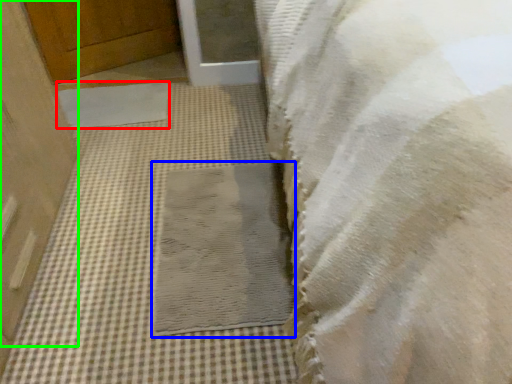
Question: Which object is the farthest from mat (highlighted by a red box)? Choose among these: mat (highlighted by a blue box) or door (highlighted by a green box).

Choices:
 (A) mat
 (B) door

Answer: (A)